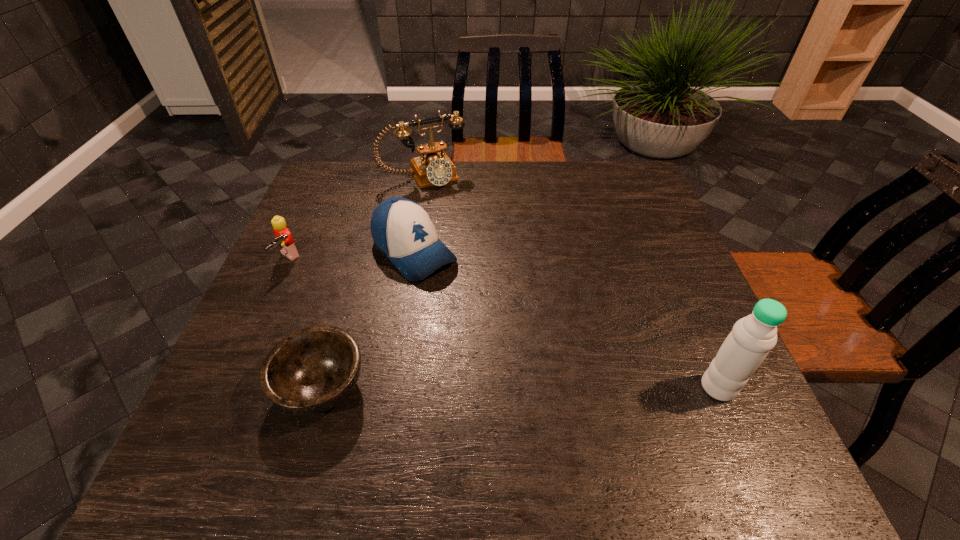
You are a GUI agent. You are given a task and a screenshot of the screen. Output one action in this format:
    pyautogui.click(x=<x>, y=<y>)
    Task: Click on the shortest object
    
    Given the screenshot: What is the action you would take?
    pyautogui.click(x=312, y=370)

This screenshot has height=540, width=960. In order to click on the rightmost object in this screenshot , I will do `click(752, 337)`.

Where is `the tallest object`? The height and width of the screenshot is (540, 960). the tallest object is located at coordinates (752, 337).

Where is `Lego`? Lego is located at coordinates (284, 239).

The image size is (960, 540). I want to click on baseball cap, so click(x=402, y=230).

Where is `telephone`? telephone is located at coordinates (434, 168).

This screenshot has width=960, height=540. Identify the location of the farthest object. (434, 168).

The image size is (960, 540). I want to click on free region located 0.090m on the back of the shortest object, so click(x=342, y=317).

The width and height of the screenshot is (960, 540). Identify the location of vacant space located on the back of the water bottle. (662, 258).

Locate an element on the screen. vacant space located in front of the Lego with the accessory visible is located at coordinates (377, 331).